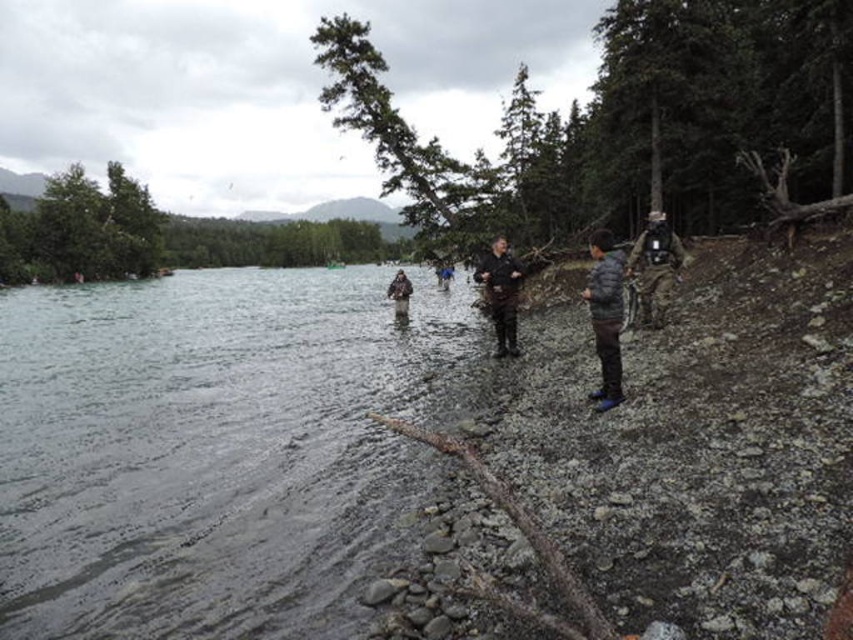
Question: Can you confirm if camouflage fabric jacket at right is positioned above dark brown leather jacket at center?

Choices:
 (A) no
 (B) yes

Answer: (B)

Question: Is rough stone shoreline at lower right below camouflage jacket at center?

Choices:
 (A) yes
 (B) no

Answer: (A)

Question: Which object is the closest to the smooth gray water at lower left?

Choices:
 (A) rough stone shoreline at lower right
 (B) camouflage jacket at center
 (C) dark gray jacket at center
 (D) camouflage fabric jacket at right

Answer: (A)

Question: Does rough stone shoreline at lower right lie in front of camouflage fabric jacket at right?

Choices:
 (A) no
 (B) yes

Answer: (B)

Question: Which point is farther from the camera taking this photo?

Choices:
 (A) (677, 376)
 (B) (612, 321)
 (C) (393, 296)

Answer: (C)

Question: Which object is the farthest from the smooth gray water at lower left?

Choices:
 (A) dark gray jacket at center
 (B) camouflage jacket at center

Answer: (A)